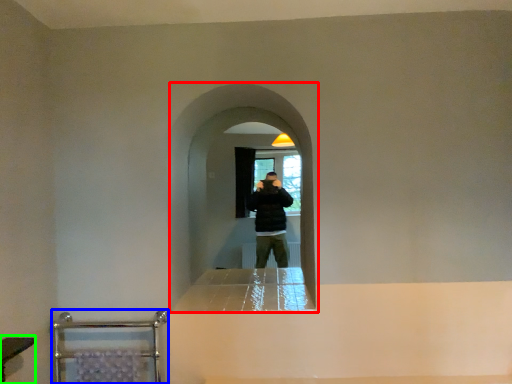
Question: Based on their relative distances, which object is nearer to screen door (highlighted by a red box)? Choose from balustrade (highlighted by a blue box) and vanity (highlighted by a green box).

Choices:
 (A) balustrade
 (B) vanity

Answer: (A)